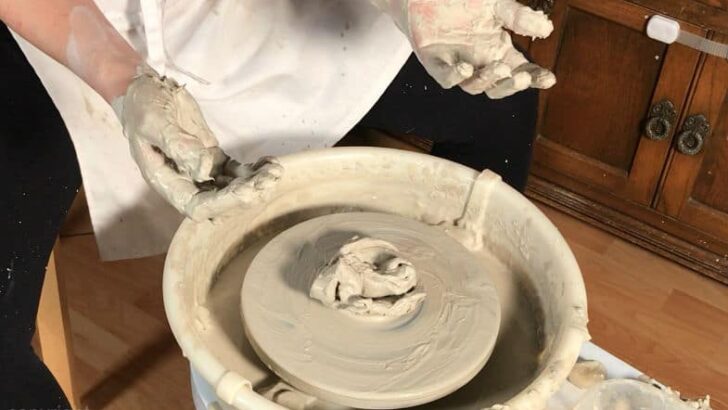
Locate an element on the screen. This screenshot has width=728, height=410. art is located at coordinates (379, 279).